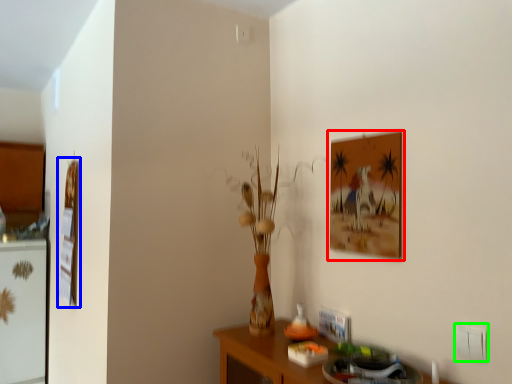
Question: Estimate the real-world distances between objects in this image. Which object is farther from picture frame (highlighted by a red box), picture frame (highlighted by a blue box) or electric outlet (highlighted by a green box)?

Choices:
 (A) picture frame
 (B) electric outlet

Answer: (A)